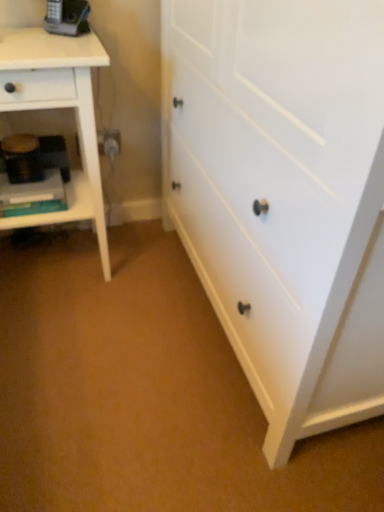
What are the coordinates of `spots to the right of white wood nightstand at left` in the screenshot? It's located at (141, 276).